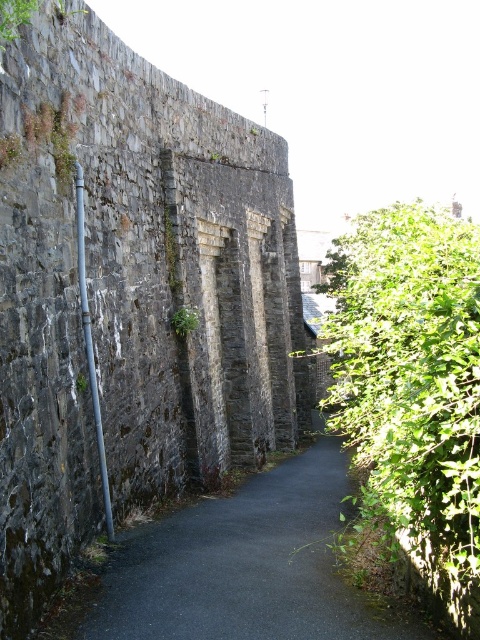
Who is positioned more to the right, green leafy bush at right or black asphalt path at center?

Positioned to the right is green leafy bush at right.

Who is more forward, (346, 308) or (197, 552)?

Point (197, 552) is more forward.

Where is `green leafy bush at right`? Image resolution: width=480 pixels, height=640 pixels. green leafy bush at right is located at coordinates (412, 387).

Which is more to the right, dark stone wall at center or green leafy bush at right?

Positioned to the right is green leafy bush at right.

Where is `dark stone wall at center`? dark stone wall at center is located at coordinates (131, 294).

Is point (118, 312) farther from camera compared to point (425, 371)?

Yes, it is.

The height and width of the screenshot is (640, 480). I want to click on dark stone wall at center, so click(x=131, y=294).

Is dark stone wall at center below black asphalt path at center?

Actually, dark stone wall at center is above black asphalt path at center.

Find the location of a particular element. This screenshot has width=480, height=640. dark stone wall at center is located at coordinates (131, 294).

Find the location of `dark stone wall at center`. dark stone wall at center is located at coordinates (131, 294).